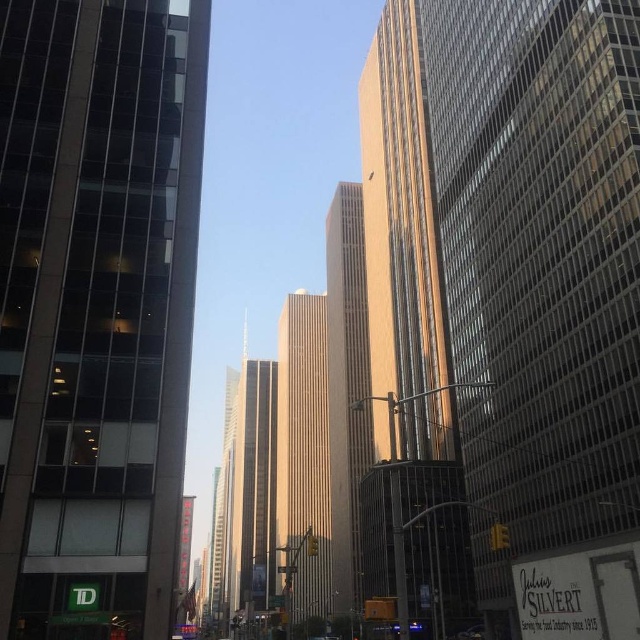
You are standing on the street looking up at the two towers in the center of the image. Which one appears nearer to you, the gold reflective glass skyscraper at center or the sandy beige concrete tower at center?

The gold reflective glass skyscraper at center appears nearer to you because it is closer to the viewer than the sandy beige concrete tower at center.

You are standing on the street looking up at the skyscrapers. There is a point marked at coordinates [96,308]. Which object in the scene does this point correspond to?

The point at [96,308] corresponds to the glassy reflective building at left.